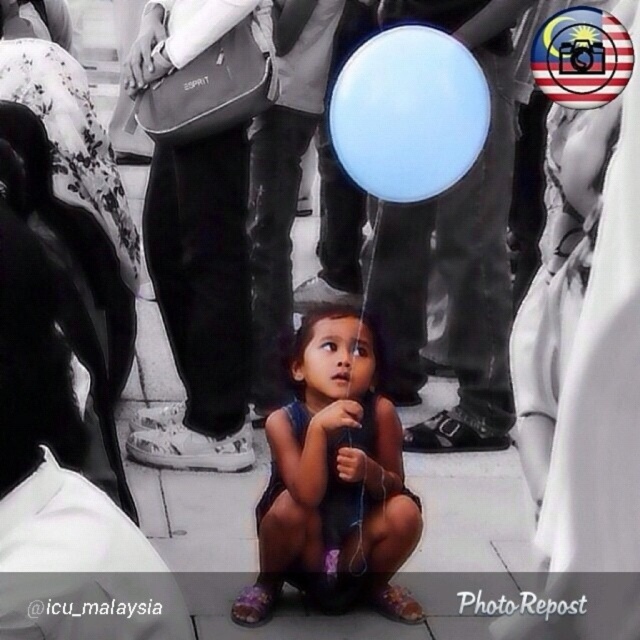
Based on the photo, you are a photographer trying to capture the child and the balloon in the image. Since the dark blue fabric dress at center and the blue matte balloon at upper center are both in the frame, which one is nearer to you?

The dark blue fabric dress at center is closer to the viewer than the blue matte balloon at upper center.